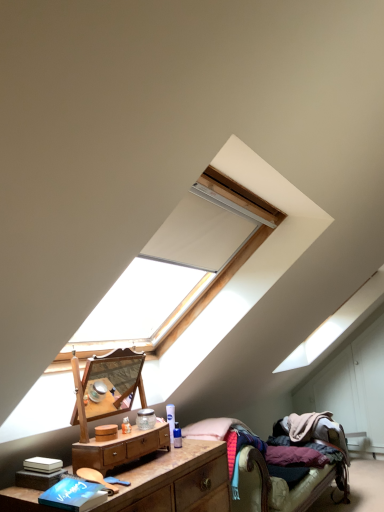
Identify the location of unoccupied region to the right of wooden polished nightstand at center, the 2th nightstand ordered from the bottom. The height and width of the screenshot is (512, 384). (184, 454).